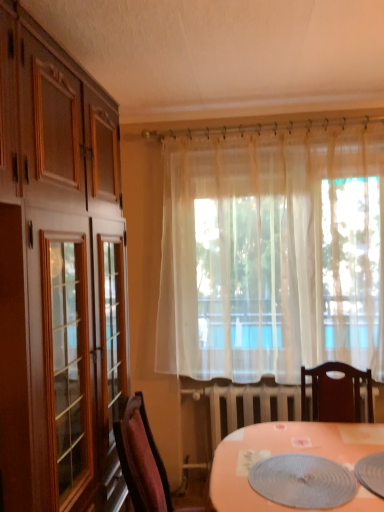
Question: In the image, is velvet burgundy chair at lower left on the left side or the right side of textured gray placemat at lower center?

Choices:
 (A) right
 (B) left

Answer: (B)

Question: Is point (148, 458) closer or farther from the camera than point (279, 488)?

Choices:
 (A) closer
 (B) farther

Answer: (B)

Question: Estimate the real-world distances between objects in this image. Which object is closer to the sheer white curtain at center?

Choices:
 (A) textured gray placemat at lower center
 (B) velvet burgundy chair at lower left

Answer: (A)

Question: Which object is the closest to the sheer white curtain at center?

Choices:
 (A) textured gray placemat at lower center
 (B) velvet burgundy chair at lower left

Answer: (A)